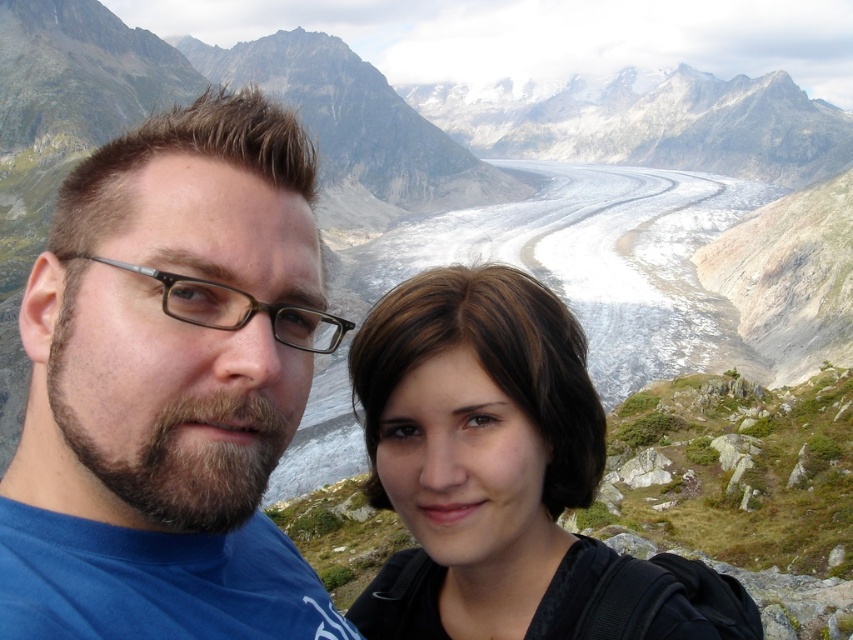
Between point (309, 253) and point (544, 368), which one is positioned in front?

Point (309, 253)

Does point (161, 317) come behind point (379, 305)?

That is False.

Locate an element on the screen. bearded man with glasses at left is located at coordinates pyautogui.click(x=169, y=387).

Is brown hair at center taller than browntransparentglasses at left?

Yes.

Does point (630, 614) come behind point (326, 326)?

No.

Find the location of a particular element. brown hair at center is located at coordinates 503,476.

Does bearded man with glasses at left have a smaller size compared to browntransparentglasses at left?

No.

Is bearded man with glasses at left bigger than browntransparentglasses at left?

Correct, bearded man with glasses at left is larger in size than browntransparentglasses at left.

Between point (74, 564) and point (199, 310), which one is positioned in front?

Point (74, 564) is more forward.

Image resolution: width=853 pixels, height=640 pixels. In order to click on bearded man with glasses at left in this screenshot , I will do `click(169, 387)`.